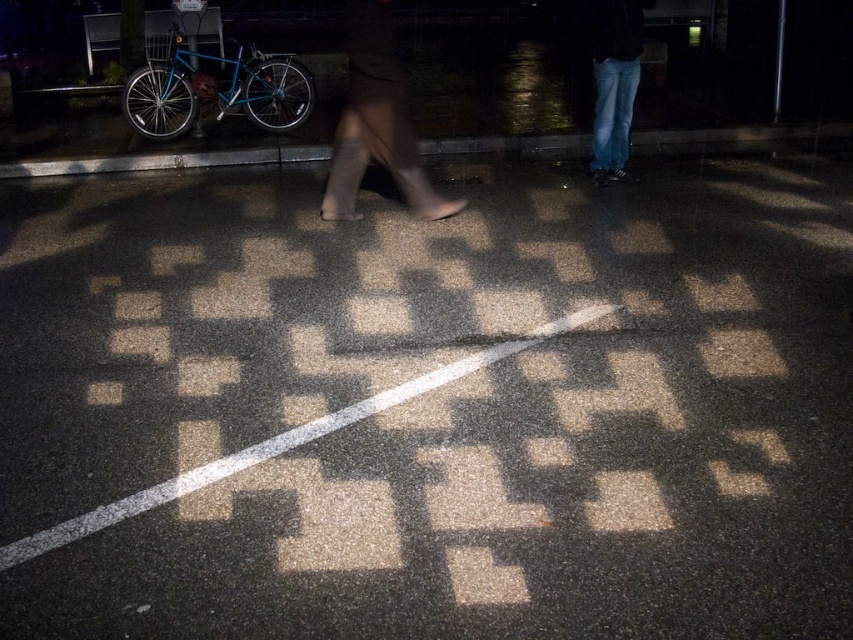
You are standing at the point with coordinates point (x=612, y=122) and want to walk to the point with coordinates point (x=352, y=81). Which direction should you move in?

You should move forward because point (x=352, y=81) is in front of point (x=612, y=122).

You are a photographer trying to capture the reflection on the wet pavement. You notice the leather boots at center and the jeans at upper right. Which object is closer to the camera?

The leather boots at center is located below jeans at upper right, meaning it is closer to the camera.

You are standing on the wet pavement at night and want to reach a point that is exactly 6 meters away from you. Based on the image, is the point at coordinates point (x=401, y=108) the correct location?

Yes, the point at point (x=401, y=108) is exactly 6.07 meters away from the viewer, so it is the correct location.